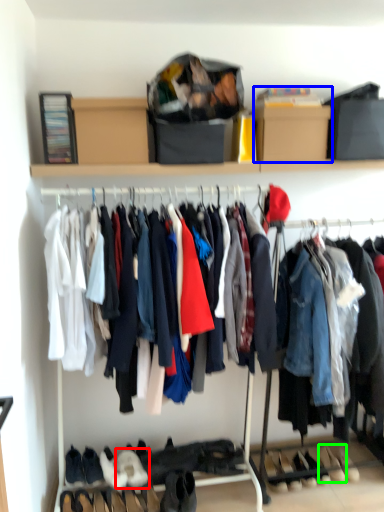
Question: Which object is the closest to the footwear (highlighted by a red box)? Choose among these: cardboard box (highlighted by a blue box) or footwear (highlighted by a green box).

Choices:
 (A) cardboard box
 (B) footwear

Answer: (B)